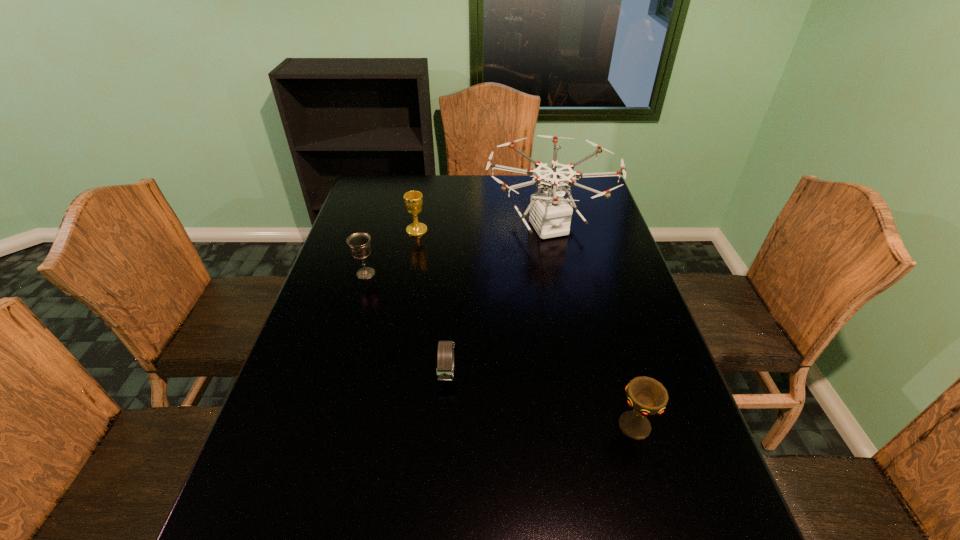
Image resolution: width=960 pixels, height=540 pixels. I want to click on free space that is in between the nearest object and the fourth object from right to left, so click(526, 328).

The width and height of the screenshot is (960, 540). What are the coordinates of `free space between the watch and the second nearest chalice` in the screenshot? It's located at (407, 323).

In order to click on the fourth closest object relative to the watch in this screenshot , I will do `click(413, 200)`.

Identify which object is the fourth nearest to the leftmost object. Please provide its 2D coordinates. Your answer should be formatted as a tuple, i.e. [(x, y)], where the tuple contains the x and y coordinates of a point satisfying the conditions above.

[(647, 396)]

Locate which chalice is the second closest to the leftmost object. Please provide its 2D coordinates. Your answer should be formatted as a tuple, i.e. [(x, y)], where the tuple contains the x and y coordinates of a point satisfying the conditions above.

[(647, 396)]

Identify the location of chalice that stands as the second closest to the second object from left to right. The width and height of the screenshot is (960, 540). (647, 396).

The height and width of the screenshot is (540, 960). I want to click on vacant region that satisfies the following two spatial constraints: 1. on the face of the watch; 2. on the left side of the rightmost chalice, so click(x=444, y=426).

Identify the location of free location that satisfies the following two spatial constraints: 1. on the back side of the farthest chalice; 2. on the right side of the tallest object. (418, 227).

Find the location of `free location that satisfies the following two spatial constraints: 1. on the face of the watch; 2. on the right side of the nearest chalice`. free location that satisfies the following two spatial constraints: 1. on the face of the watch; 2. on the right side of the nearest chalice is located at coordinates (444, 426).

Locate an element on the screen. This screenshot has height=540, width=960. free space that satisfies the following two spatial constraints: 1. on the front side of the leftmost chalice; 2. on the left side of the nearest object is located at coordinates (321, 426).